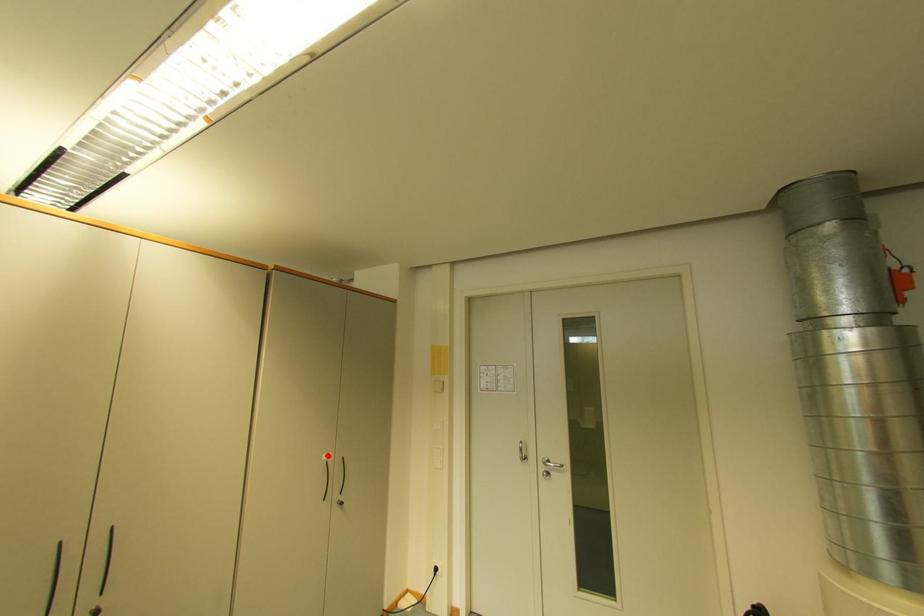
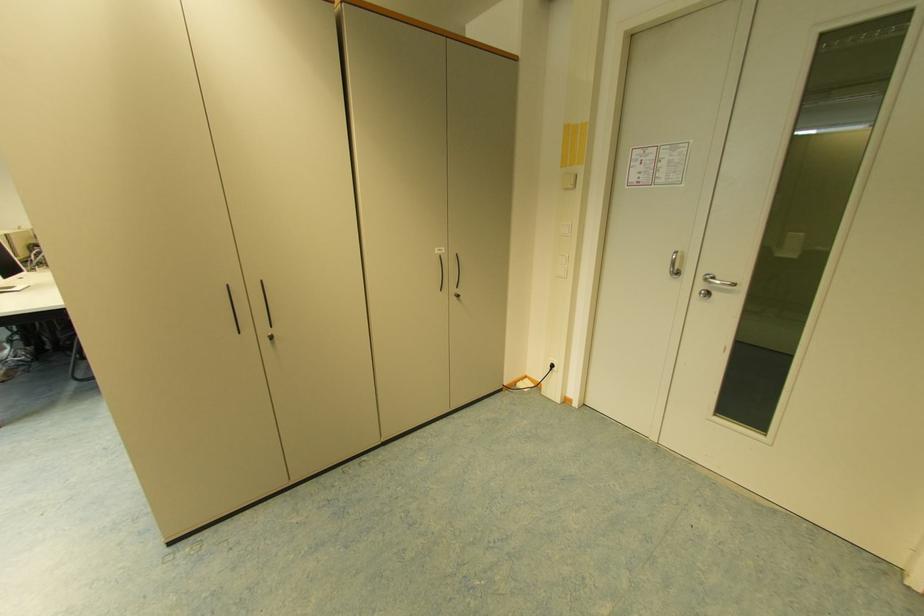
Where in the second image is the point corresponding to the highlighted location from the first image?

(440, 249)